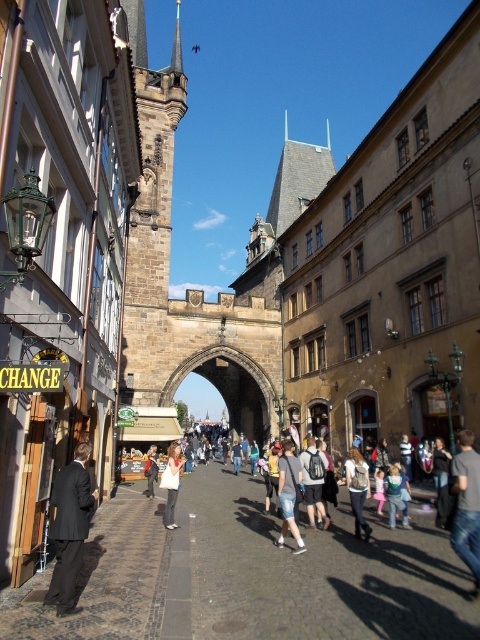
You are a traveler who just arrived in Prague and wants to change money. You see jeans at lower right and denim shorts at center. Which clothing item is wider?

The jeans at lower right is wider than the denim shorts at center.

You are standing at the Charles Bridge towers in the background of the scene. You see a black suit at left and a denim shorts at center. Which object is closer to you?

The black suit at left is 19.66 meters away from the denim shorts at center. Since you are at the Charles Bridge towers, the black suit at left is closer to you than the denim shorts at center because it is positioned to the left side of the street, which is nearer to your current position.

You are standing on the cobblestone street in front of the buildings. There are two points marked on the image. One is at coordinate point (290, 449) and the other is at point (172, 468). Which point is closer to you?

Point (290, 449) is closer to the camera than point (172, 468), so the point at coordinate (290, 449) is closer to you.